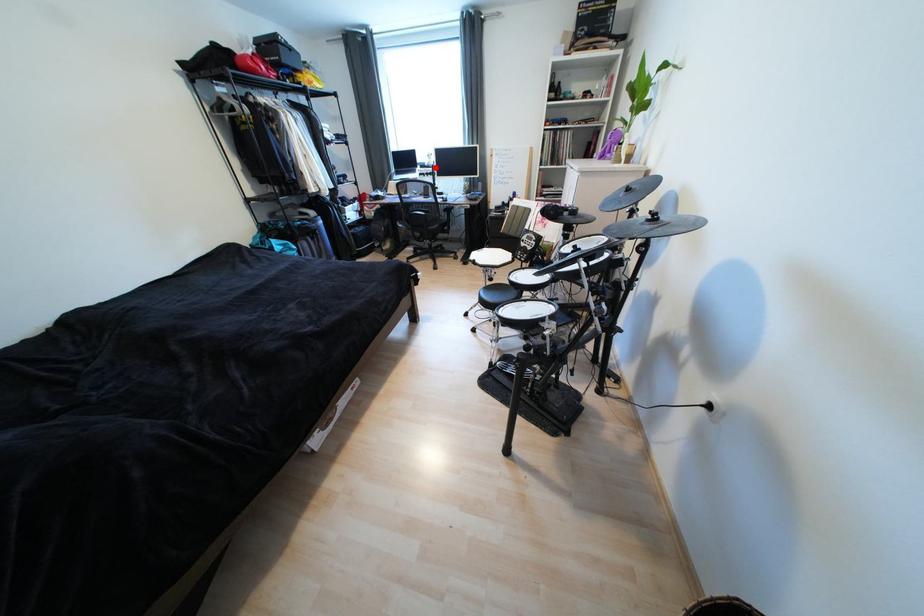
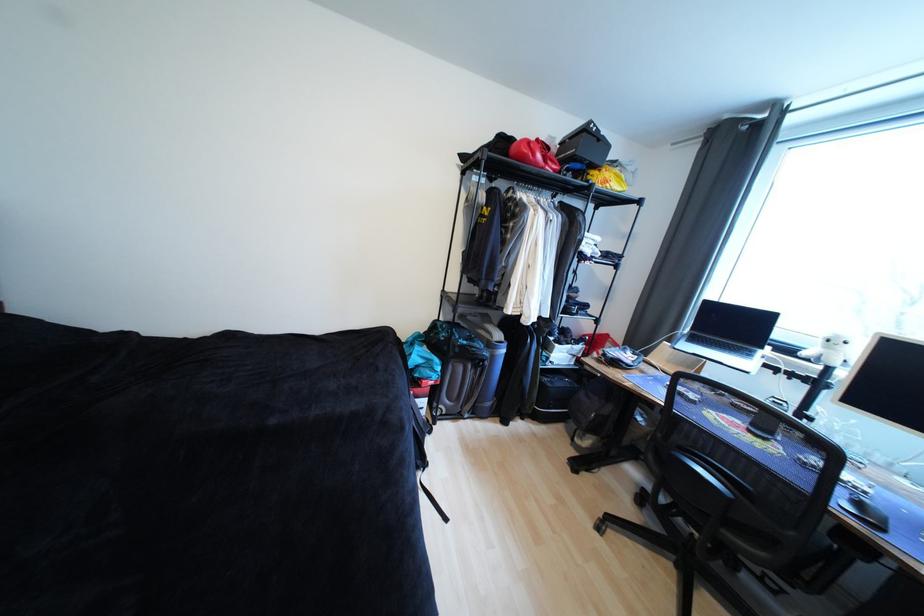
Question: A red point is marked in image1. In image2, is the corresponding 3D point closer to the camera or farther? Reply with the corresponding letter.

Choices:
 (A) The corresponding 3D point is closer.
 (B) The corresponding 3D point is farther.

Answer: (B)